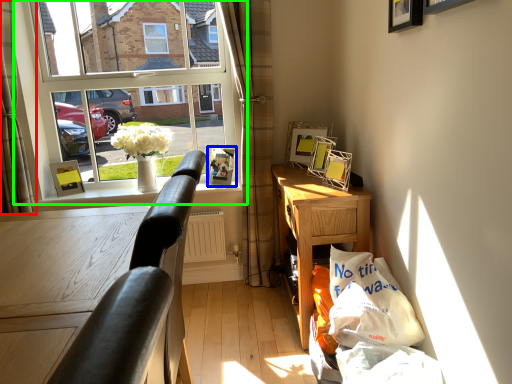
Question: Estimate the real-world distances between objects in this image. Which object is closer to curtain (highlighted by a red box), picture frame (highlighted by a blue box) or window (highlighted by a green box)?

Choices:
 (A) picture frame
 (B) window

Answer: (B)